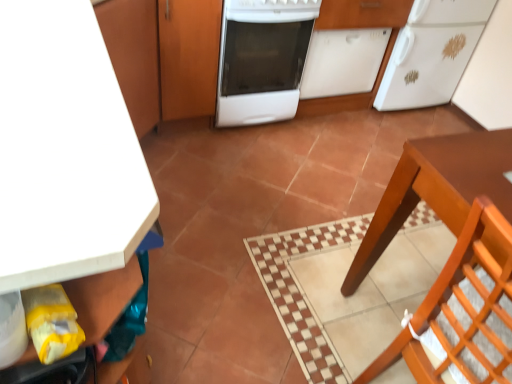
Question: Is white glossy dishwasher at center taller or shorter than white matte dishwasher at center, acting as the first cabinetry starting from the right?

Choices:
 (A) tall
 (B) short

Answer: (A)

Question: Is white glossy dishwasher at center to the left or to the right of white matte dishwasher at center, acting as the first cabinetry starting from the right, in the image?

Choices:
 (A) right
 (B) left

Answer: (B)

Question: Estimate the real-world distances between objects in this image. Which object is closer to the wooden cabinet at center, arranged as the third cabinetry when viewed from the left?

Choices:
 (A) wooden chair at lower right
 (B) white glossy dishwasher at center
 (C) matte wood cabinet at upper left, the 4th cabinetry positioned from the right
 (D) white matte dishwasher at center, the 4th cabinetry from the left
 (E) brown wooden table at lower right

Answer: (C)

Question: Based on their relative distances, which object is farther from the white matte dishwasher at center, acting as the first cabinetry starting from the right?

Choices:
 (A) white matte cabinet at upper left, which is counted as the second cabinetry, starting from the left
 (B) white glossy dishwasher at center
 (C) wooden cabinet at center, arranged as the second cabinetry when viewed from the right
 (D) wooden chair at lower right
 (E) matte wood cabinet at upper left, the 4th cabinetry positioned from the right

Answer: (D)